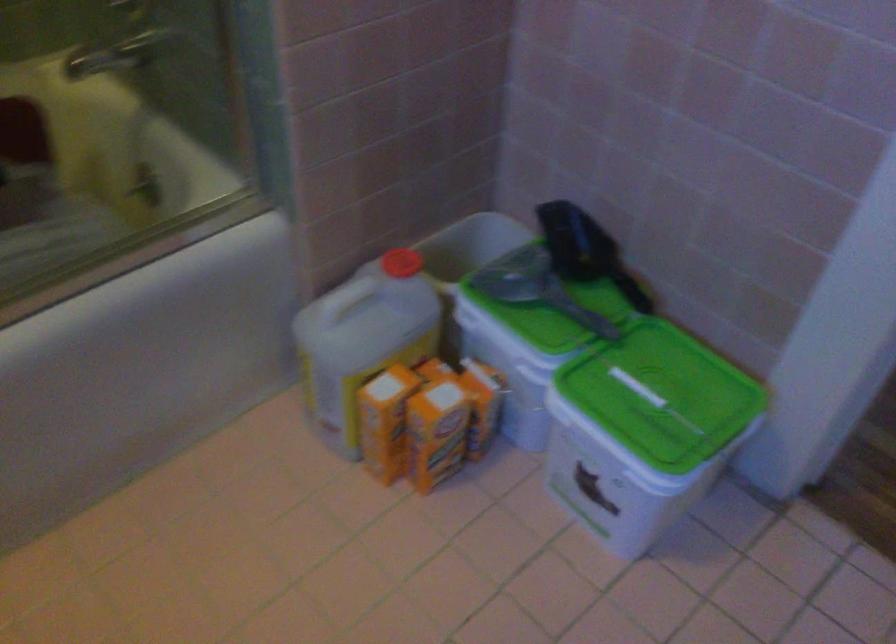
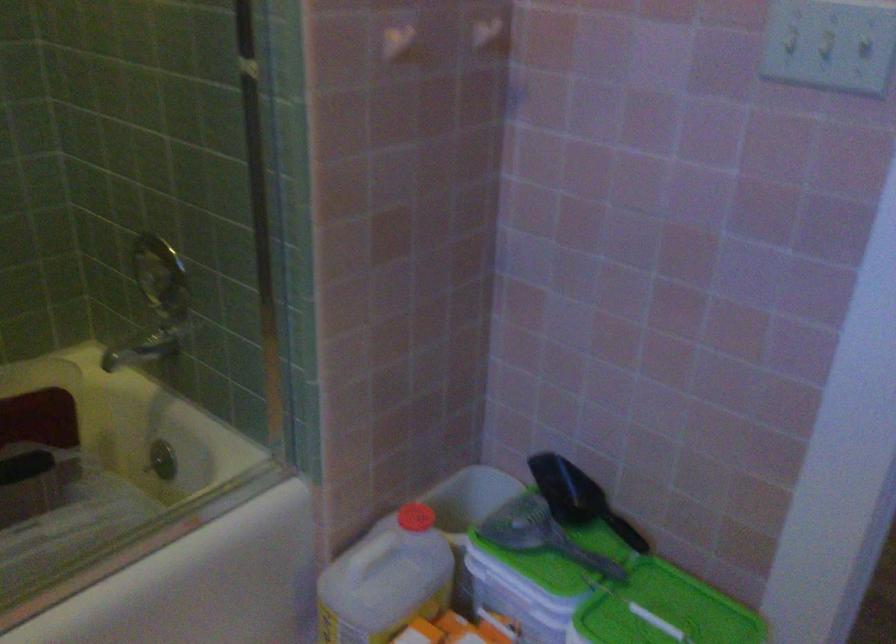
The point at (364, 326) is marked in the first image. Where is the corresponding point in the second image?

(385, 581)